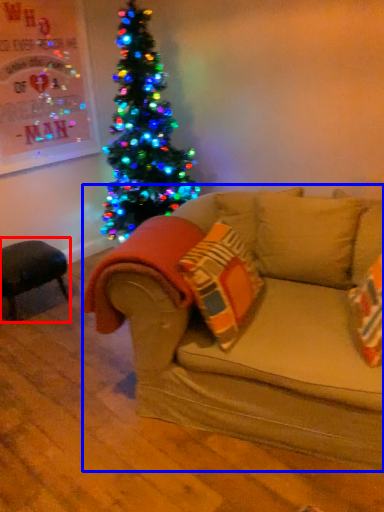
Question: Which of the following is the closest to the observer, swivel chair (highlighted by a red box) or studio couch (highlighted by a blue box)?

Choices:
 (A) swivel chair
 (B) studio couch

Answer: (B)